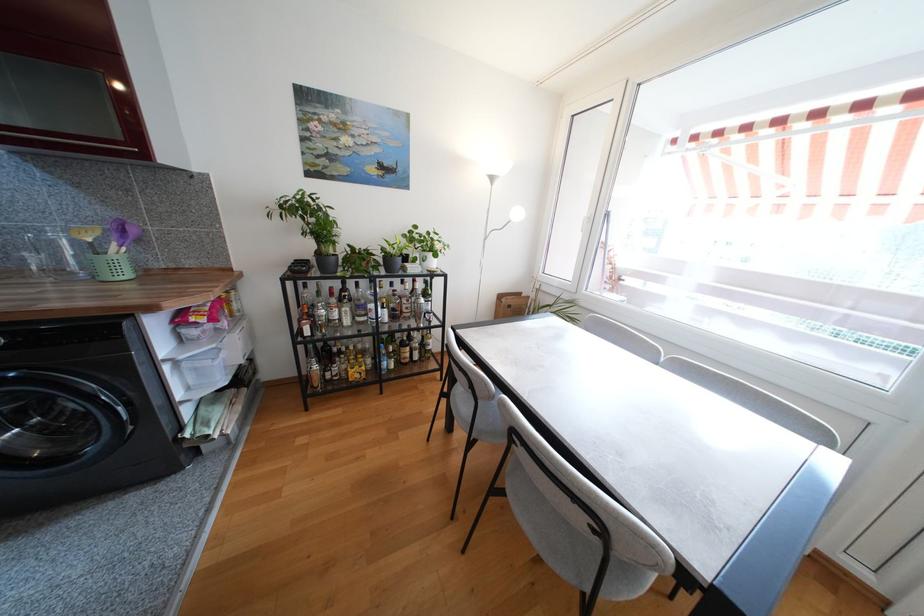
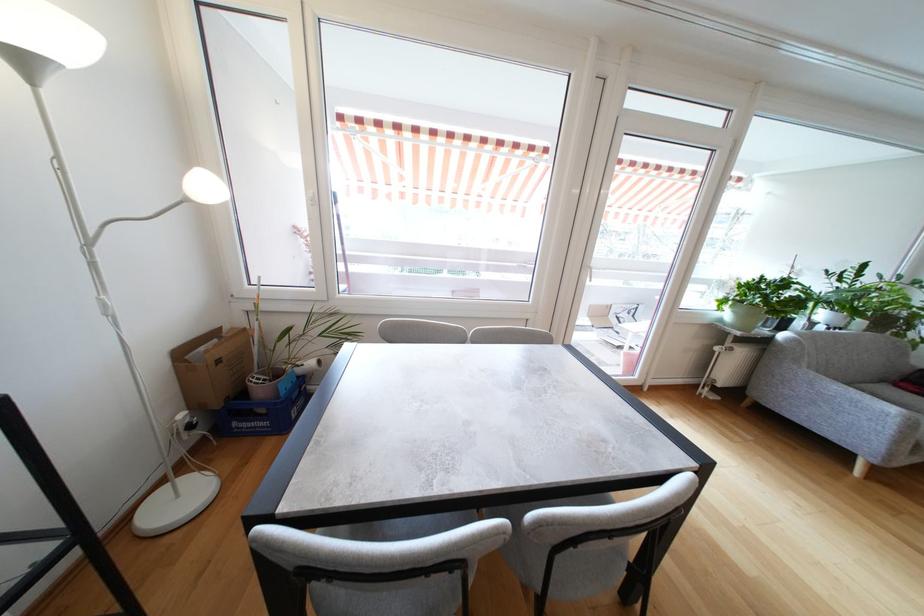
First-person continuous shooting, in which direction is the camera rotating?

The rotation direction of the camera is right-down.